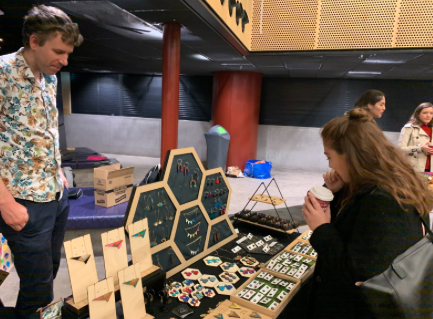
The width and height of the screenshot is (433, 319). Find the location of `brown cardboard box with black writing - opened`. brown cardboard box with black writing - opened is located at coordinates (117, 196).